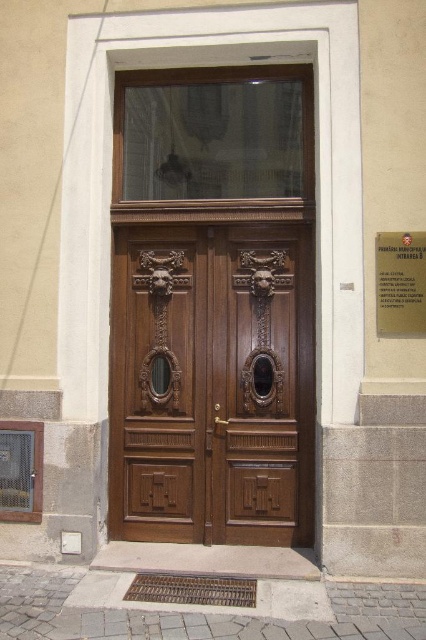
You are standing in front of the building and want to locate the polished wood door at center. What are its coordinates?

The polished wood door at center is located at coordinates point (212, 385).